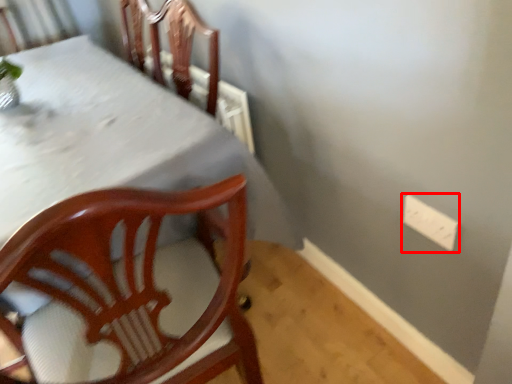
Question: From the image's perspective, what is the correct spatial relationship of electric outlet (annotated by the red box) in relation to table?

Choices:
 (A) above
 (B) below

Answer: (A)